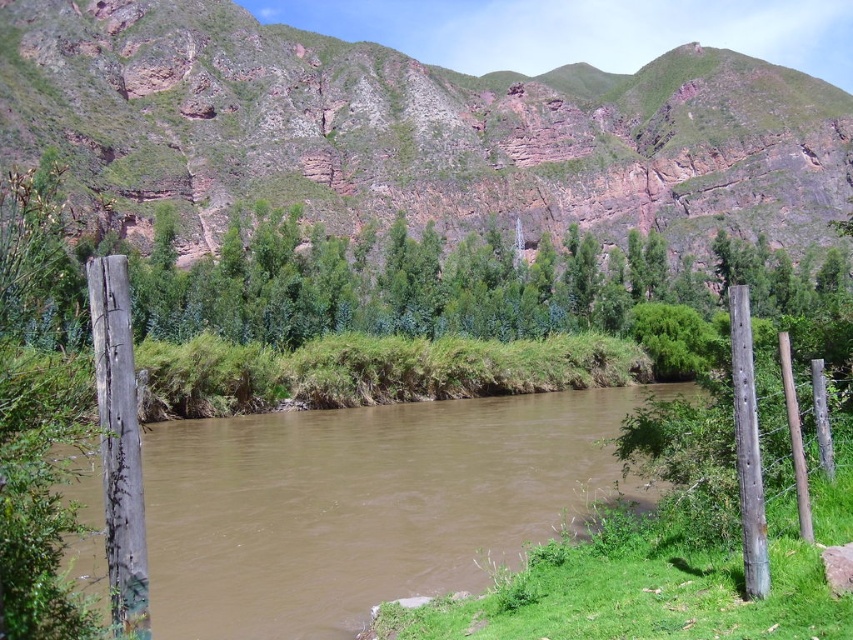
Is brown muddy water at center further to the viewer compared to gray weathered wood post at right?

No, brown muddy water at center is in front of gray weathered wood post at right.

Is brown muddy water at center below gray weathered wood post at right?

Indeed, brown muddy water at center is positioned under gray weathered wood post at right.

Image resolution: width=853 pixels, height=640 pixels. In order to click on brown muddy water at center in this screenshot , I will do `click(364, 504)`.

Does rustic rock cliff at center have a larger size compared to brown muddy water at center?

Indeed, rustic rock cliff at center has a larger size compared to brown muddy water at center.

The width and height of the screenshot is (853, 640). Find the location of `rustic rock cliff at center`. rustic rock cliff at center is located at coordinates [412, 129].

Find the location of `rustic rock cliff at center`. rustic rock cliff at center is located at coordinates (412, 129).

Identify the location of rustic rock cliff at center. This screenshot has height=640, width=853. (412, 129).

Does rustic rock cliff at center have a larger size compared to weathered wood post at left?

Yes.

Can you confirm if rustic rock cliff at center is thinner than weathered wood post at left?

No, rustic rock cliff at center is not thinner than weathered wood post at left.

Which is behind, point (311, 60) or point (93, 316)?

The point (311, 60) is behind.

This screenshot has height=640, width=853. Find the location of `rustic rock cliff at center`. rustic rock cliff at center is located at coordinates (412, 129).